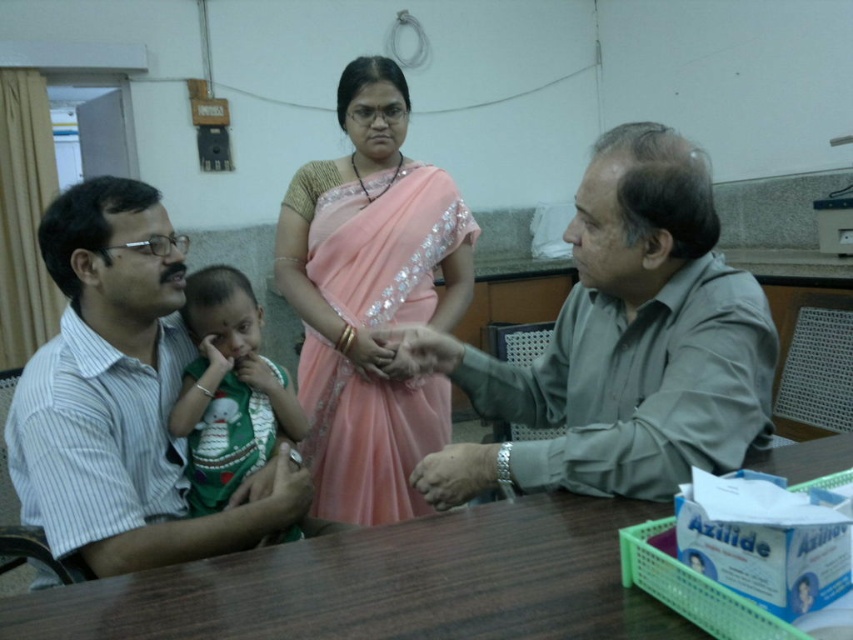
You are observing two people in an office setting. The first person is wearing a gray matte shirt at center, and the second is wearing a white striped shirt at left. Based on their positions and the description provided, which individual appears shorter?

The gray matte shirt at center is shorter in height compared to the white striped shirt at left, so the person wearing the gray matte shirt at center appears shorter.

You are standing in the office and want to place a small plant between the two points marked as point (370, 580) and point (421, 394). Which point should the plant be closer to in order to be equidistant from both points?

The plant should be placed exactly halfway between point (370, 580) and point (421, 394) to be equidistant from both points.